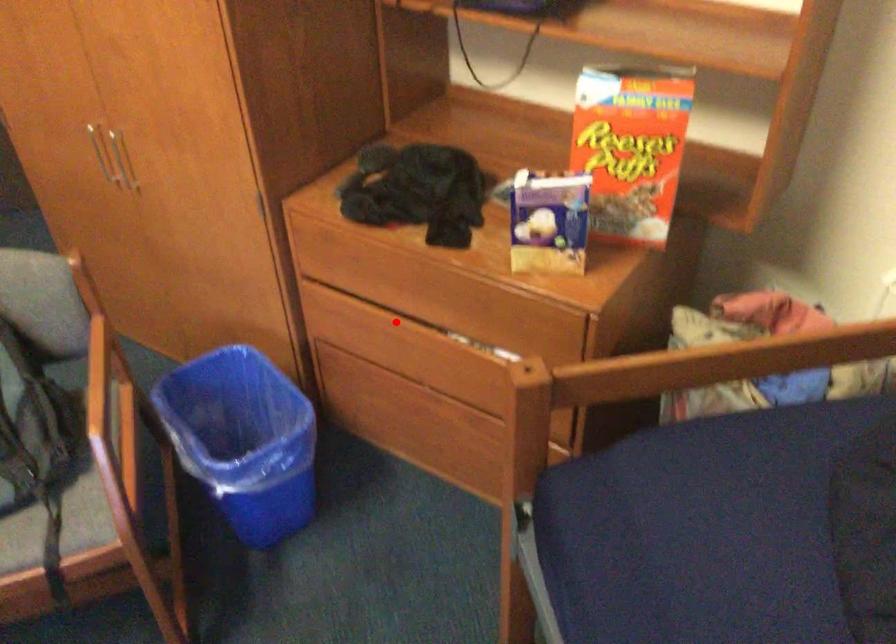
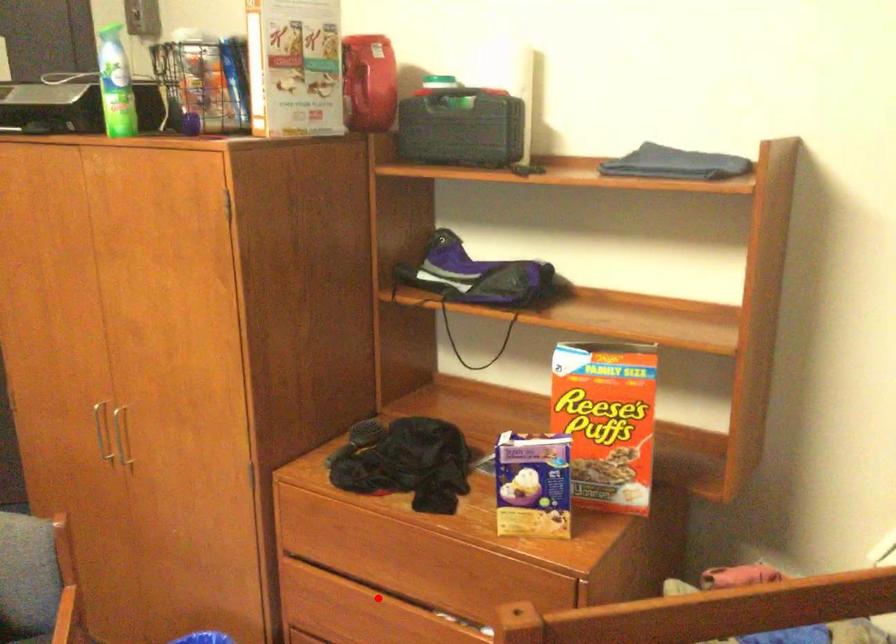
I am providing you with two images of the same scene from different viewpoints. A red point is marked on the first image and another point is marked on the second image. Does the point marked in image1 correspond to the same location as the one in image2?

Yes